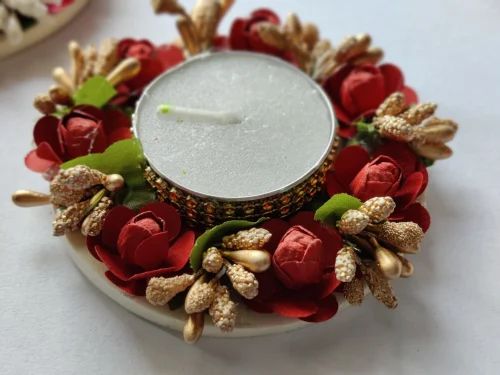
Locate an element on the screen. fake green leaves is located at coordinates (335, 205), (212, 231), (118, 156), (137, 194), (97, 91), (365, 131).